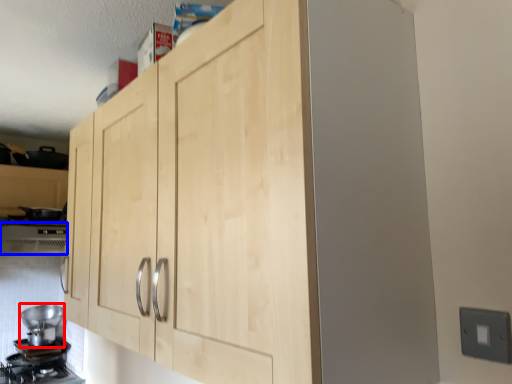
Question: Which of the following is the closest to the observer, appliance (highlighted by a red box) or vent (highlighted by a blue box)?

Choices:
 (A) appliance
 (B) vent

Answer: (B)